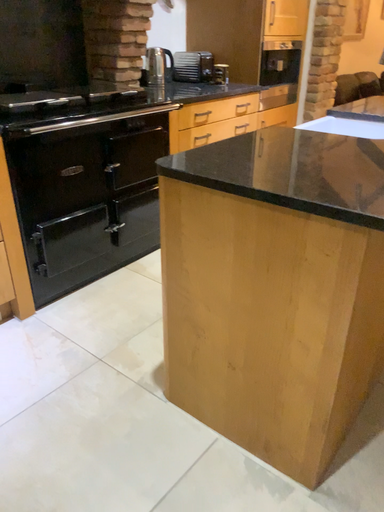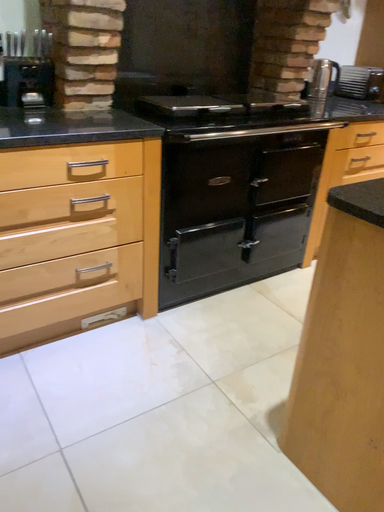
Question: How did the camera likely rotate when shooting the video?

Choices:
 (A) rotated left
 (B) rotated right

Answer: (A)